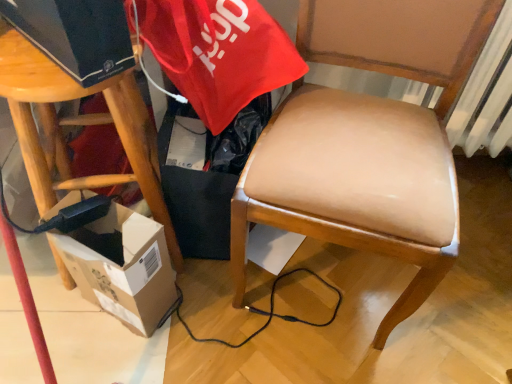
I want to click on vacant space underneath leather-like tan chair at center (from a real-world perspective), so click(x=327, y=284).